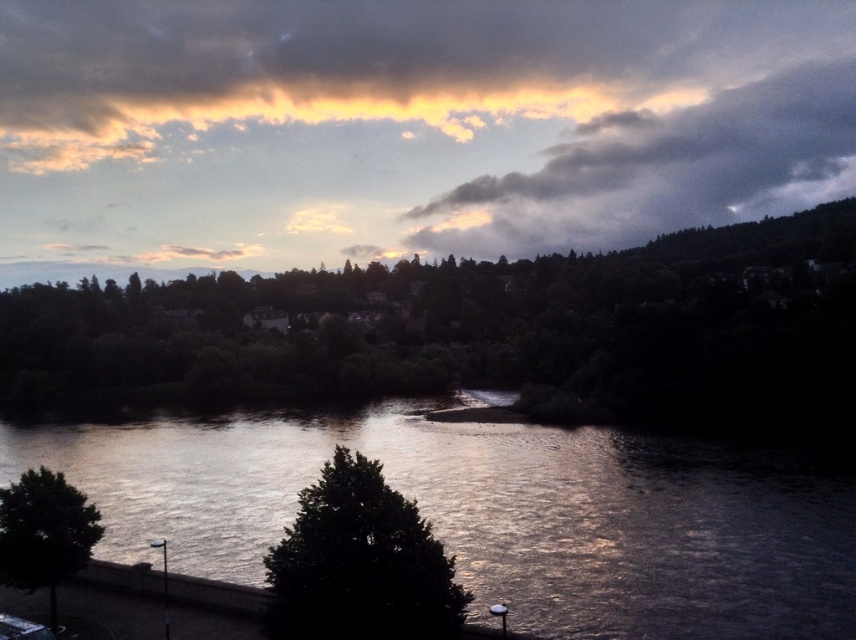
You are standing at the green leafy tree at center. You want to walk to the other side of the river. The river is flowing from the north to the south. If you walk directly east from your current position, will you be able to reach the opposite bank without crossing the river?

The distance between the green leafy tree at center and the other side of the river is 56.99 meters. Since you are walking directly east, which is perpendicular to the river flow direction, you can reach the opposite bank without crossing the river.